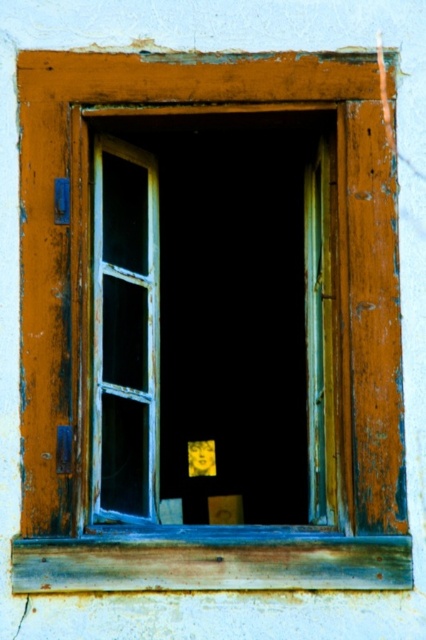
Question: Which point is closer to the camera taking this photo?

Choices:
 (A) (95, 381)
 (B) (353, 573)

Answer: (B)

Question: In this image, where is wooden frame window at center located relative to rusty wood window sill at lower center?

Choices:
 (A) left
 (B) right

Answer: (A)

Question: Is wooden frame window at center below rusty wood window sill at lower center?

Choices:
 (A) no
 (B) yes

Answer: (A)

Question: Which point is closer to the camera?

Choices:
 (A) wooden frame window at center
 (B) rusty wood window sill at lower center

Answer: (B)

Question: Is wooden frame window at center above rusty wood window sill at lower center?

Choices:
 (A) yes
 (B) no

Answer: (A)